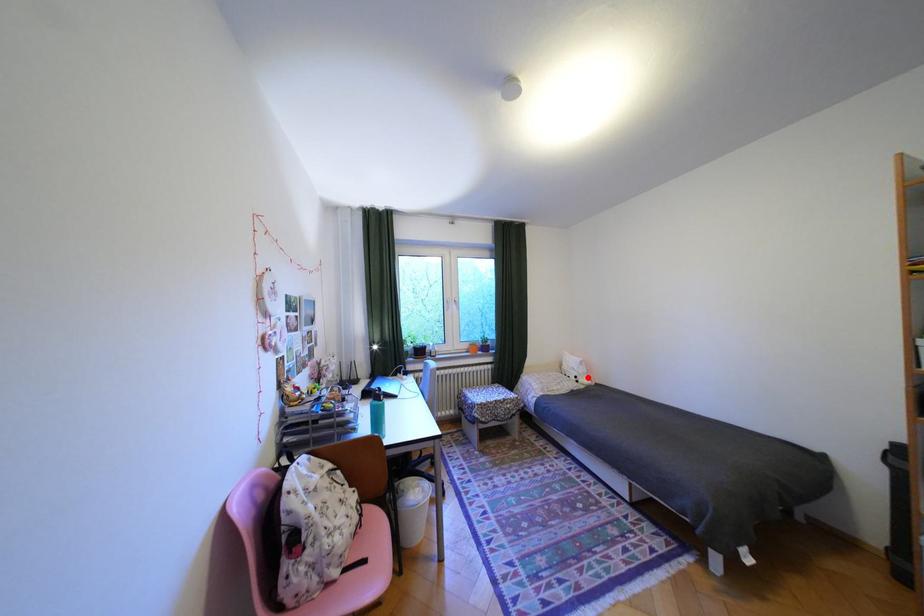
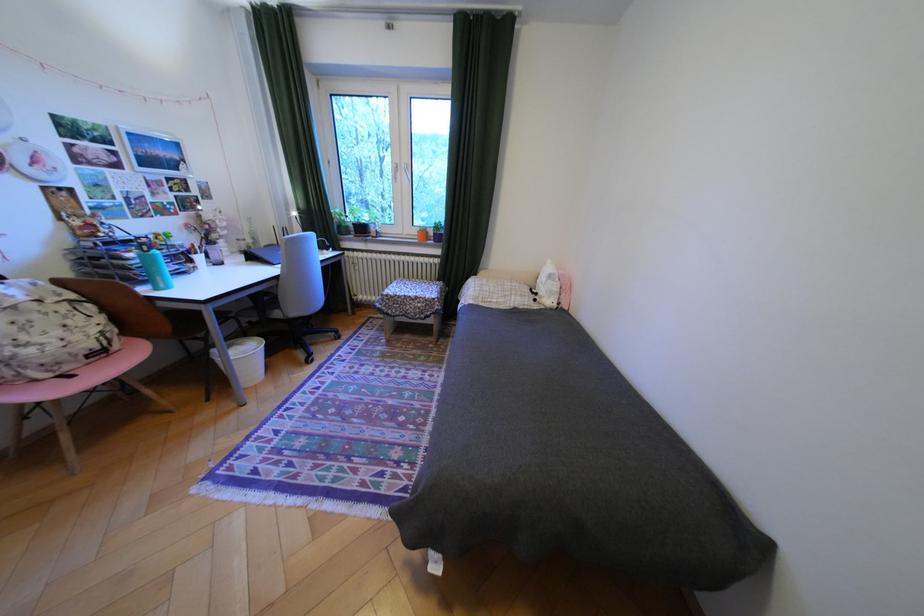
Question: I am providing you with two images of the same scene from different viewpoints. Image1 has a red point marked. In image2, the corresponding 3D location appears at what relative position? Reply with the corresponding letter.

Choices:
 (A) Closer
 (B) Farther

Answer: (A)